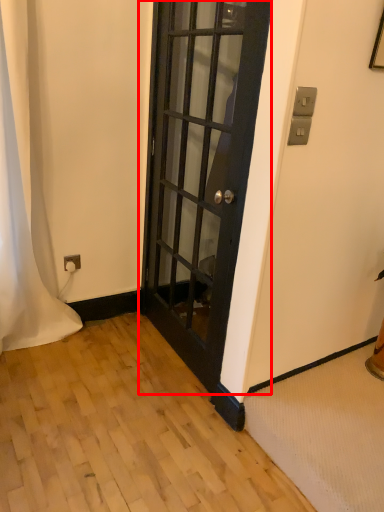
Question: From the image, what is the correct spatial relationship of door (annotated by the red box) in relation to curtain?

Choices:
 (A) right
 (B) left

Answer: (A)